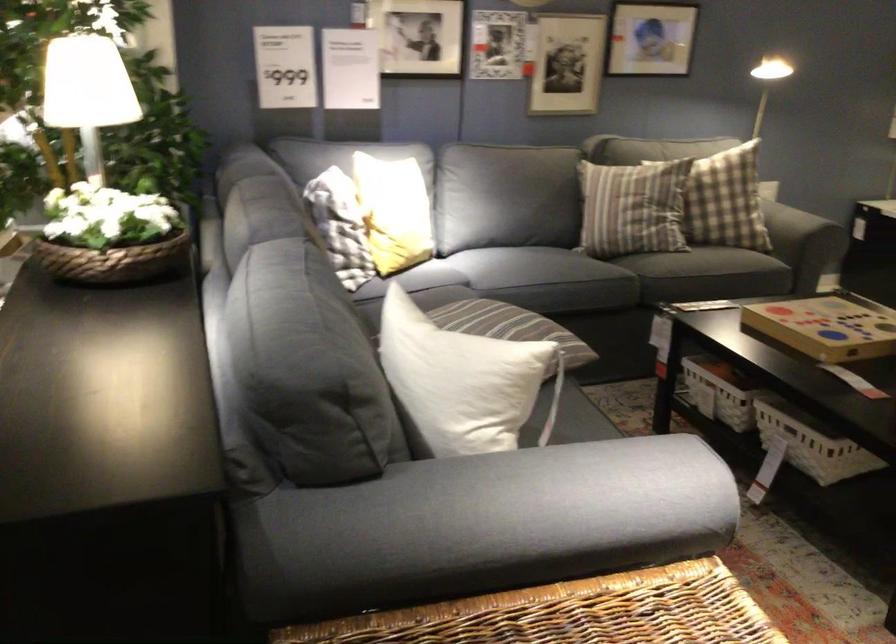
What do you see at coordinates (538, 267) in the screenshot? The height and width of the screenshot is (644, 896). I see `the sofa sitting surface` at bounding box center [538, 267].